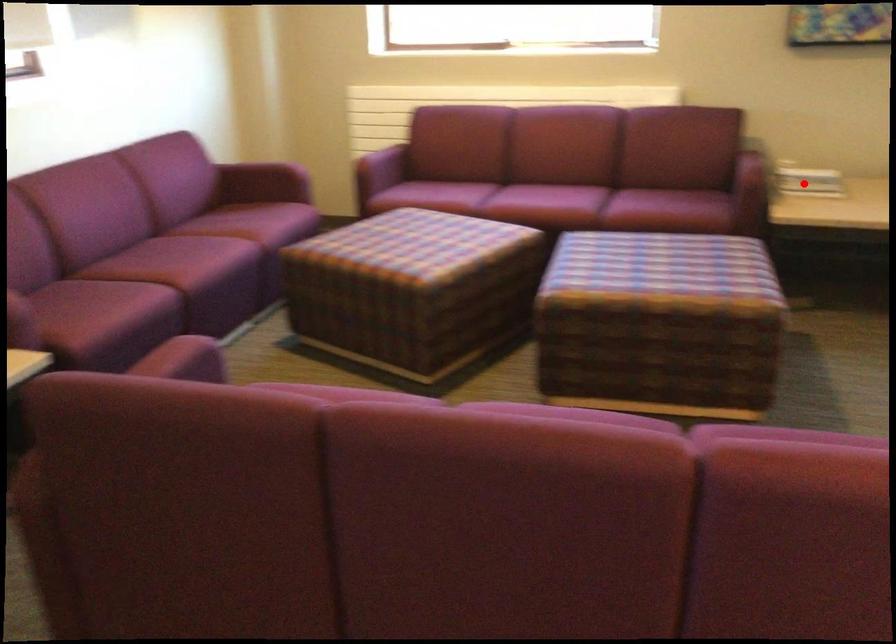
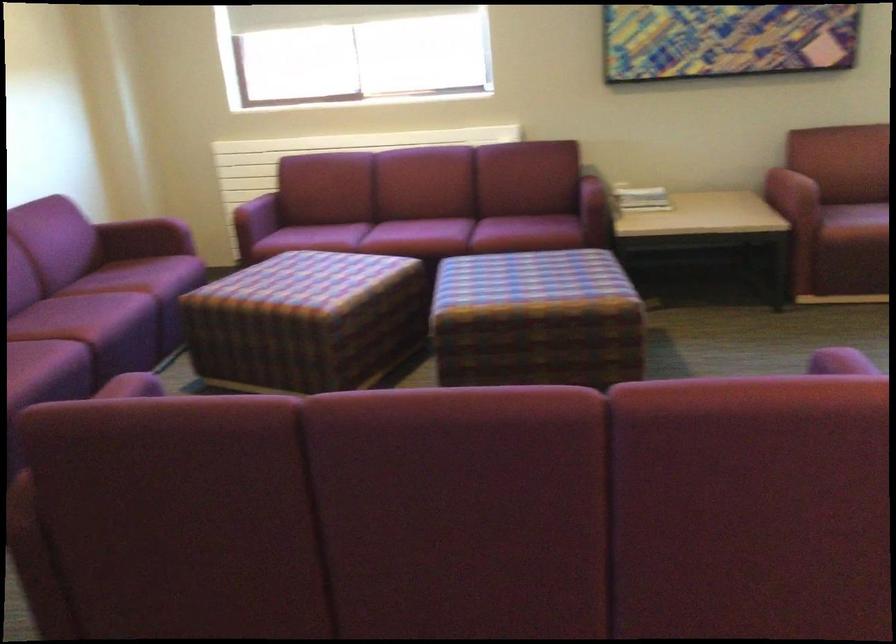
Question: I am providing you with two images of the same scene from different viewpoints. A red point is shown in image1. For the corresponding object point in image2, is it positioned nearer or farther from the camera?

Choices:
 (A) Nearer
 (B) Farther

Answer: (B)